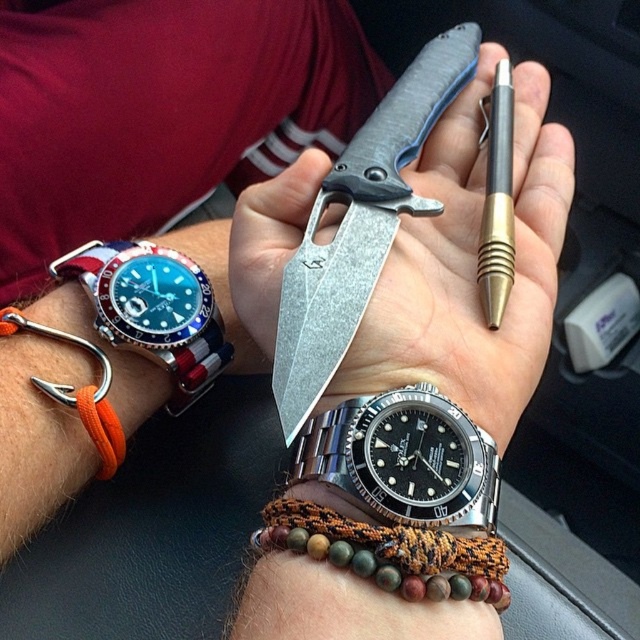
You are a designer creating a digital replica of this scene. To place the blue dial steel watch at left accurately, what are its coordinates?

The blue dial steel watch at left is located at coordinates point (154,308).

You are designing a wristband that needs to fit snugly around the black stainless steel watch at center and the matte black pen at center. Which object requires a wider wristband to accommodate its width?

The black stainless steel watch at center requires a wider wristband because it is wider than the matte black pen at center according to the description.

You are a passenger in a car and notice two points on the dashboard. The first point is at coordinates point (369, 420) and the second is at point (124, 336). Which point is closer to you?

Point (369, 420) is in front of point (124, 336), so the first point is closer to you.